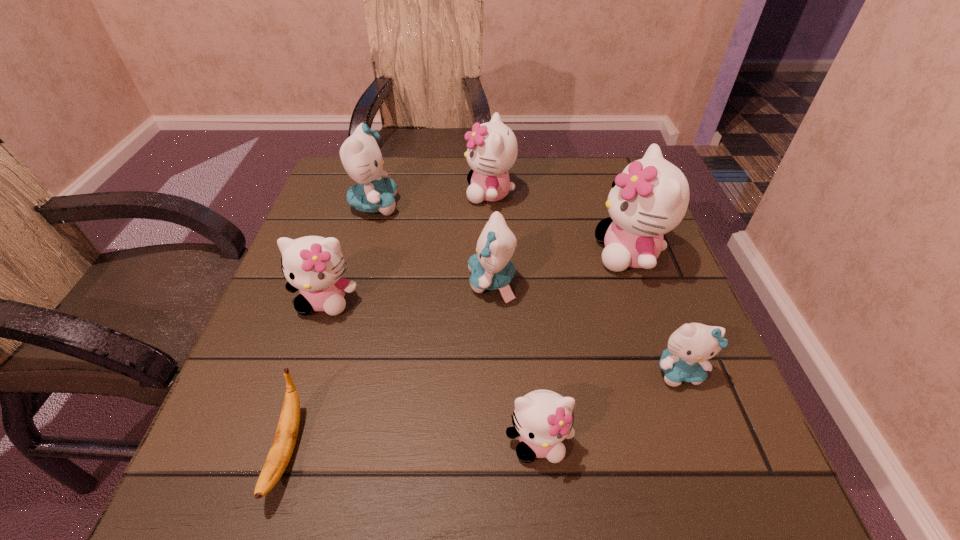
Locate an element on the screen. The image size is (960, 540). the biggest white kitten is located at coordinates point(650,197).

This screenshot has width=960, height=540. What are the coordinates of `the tallest object` in the screenshot? It's located at (650, 197).

The height and width of the screenshot is (540, 960). Identify the location of the leftmost blue kitten. (360, 154).

Image resolution: width=960 pixels, height=540 pixels. I want to click on the biggest blue kitten, so click(360, 154).

Find the location of a particular element. The height and width of the screenshot is (540, 960). the farthest white kitten is located at coordinates (492, 150).

I want to click on the second biggest blue kitten, so click(x=491, y=268).

Image resolution: width=960 pixels, height=540 pixels. I want to click on the second farthest blue kitten, so click(x=491, y=268).

Identify the location of the third biggest white kitten. The image size is (960, 540). (313, 264).

Where is `the smallest white kitten`? The image size is (960, 540). the smallest white kitten is located at coordinates (542, 419).

Where is `the nearest white kitten`? the nearest white kitten is located at coordinates (542, 419).